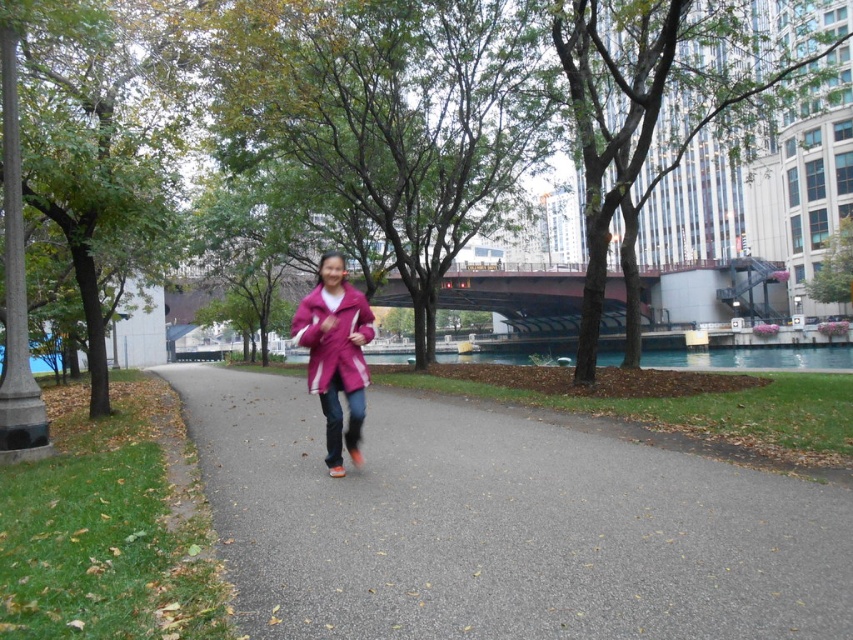
Does pink matte jacket at center have a lesser width compared to matte pink jacket at center?

Yes.

Which is below, pink matte jacket at center or matte pink jacket at center?

pink matte jacket at center is lower down.

Which is behind, point (323, 362) or point (347, 308)?

The point (347, 308) is more distant.

Locate an element on the screen. The width and height of the screenshot is (853, 640). pink matte jacket at center is located at coordinates (335, 355).

Can you confirm if smooth asphalt path at center is taller than matte pink jacket at center?

In fact, smooth asphalt path at center may be shorter than matte pink jacket at center.

Can you confirm if smooth asphalt path at center is positioned below matte pink jacket at center?

Correct, smooth asphalt path at center is located below matte pink jacket at center.

Is point (253, 428) less distant than point (360, 316)?

No, it is not.

Find the location of a particular element. The width and height of the screenshot is (853, 640). smooth asphalt path at center is located at coordinates (502, 525).

Does smooth asphalt path at center have a lesser width compared to pink matte jacket at center?

No.

Can you confirm if smooth asphalt path at center is positioned below pink matte jacket at center?

Yes, smooth asphalt path at center is below pink matte jacket at center.

The width and height of the screenshot is (853, 640). Describe the element at coordinates (502, 525) in the screenshot. I see `smooth asphalt path at center` at that location.

The image size is (853, 640). In order to click on smooth asphalt path at center in this screenshot , I will do `click(502, 525)`.